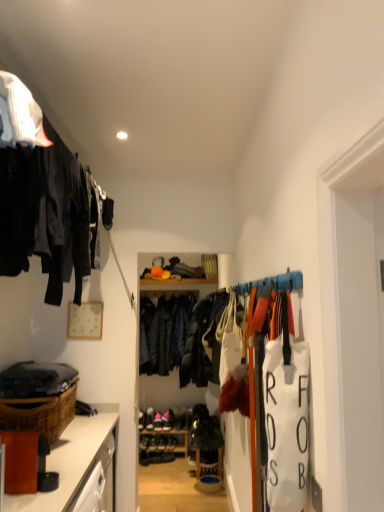
Question: Does brown woven basket at lower left have a greater height compared to pink suede shoes at center?

Choices:
 (A) yes
 (B) no

Answer: (A)

Question: Is brown woven basket at lower left aimed at pink suede shoes at center?

Choices:
 (A) yes
 (B) no

Answer: (B)

Question: Can you confirm if brown woven basket at lower left is shorter than pink suede shoes at center?

Choices:
 (A) yes
 (B) no

Answer: (B)

Question: From a real-world perspective, is brown woven basket at lower left physically below pink suede shoes at center?

Choices:
 (A) yes
 (B) no

Answer: (B)

Question: Would you say brown woven basket at lower left is outside pink suede shoes at center?

Choices:
 (A) no
 (B) yes

Answer: (B)

Question: Does brown woven basket at lower left have a smaller size compared to pink suede shoes at center?

Choices:
 (A) yes
 (B) no

Answer: (B)

Question: From a real-world perspective, is matte black clothing at upper left positioned under dark blue leather jacket at center based on gravity?

Choices:
 (A) yes
 (B) no

Answer: (B)

Question: Does matte black clothing at upper left have a greater width compared to dark blue leather jacket at center?

Choices:
 (A) yes
 (B) no

Answer: (A)

Question: From the image's perspective, would you say matte black clothing at upper left is positioned over dark blue leather jacket at center?

Choices:
 (A) yes
 (B) no

Answer: (A)

Question: Can you confirm if matte black clothing at upper left is taller than dark blue leather jacket at center?

Choices:
 (A) no
 (B) yes

Answer: (A)

Question: Is matte black clothing at upper left looking in the opposite direction of dark blue leather jacket at center?

Choices:
 (A) yes
 (B) no

Answer: (B)

Question: Does matte black clothing at upper left come in front of dark blue leather jacket at center?

Choices:
 (A) no
 (B) yes

Answer: (B)

Question: From the image's perspective, is pink suede shoes at center located beneath brown woven basket at lower left?

Choices:
 (A) no
 (B) yes

Answer: (B)